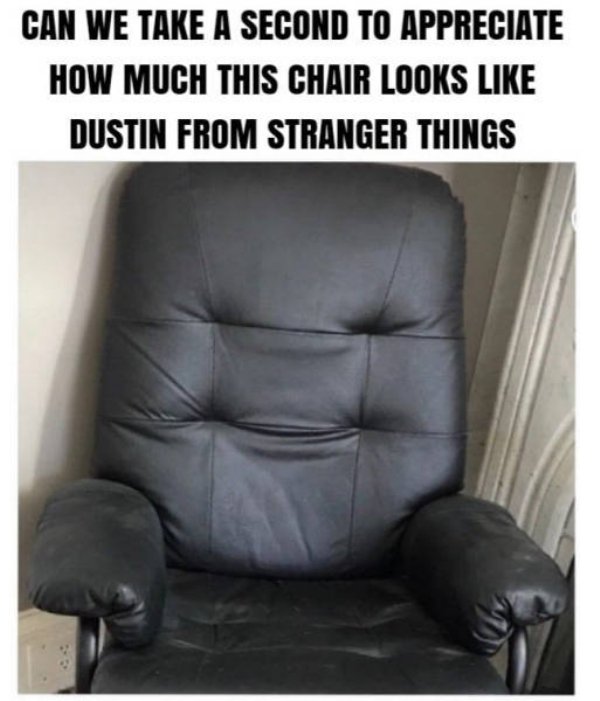
Find the location of `door frame`. door frame is located at coordinates point(544,336).